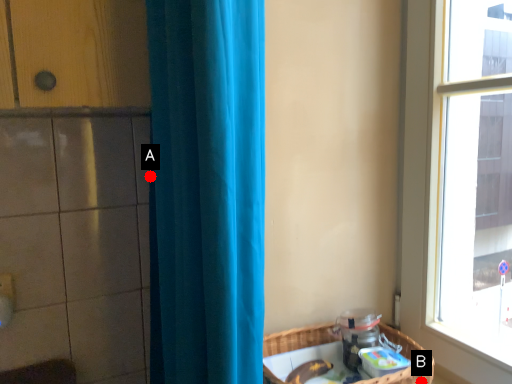
Question: Two points are circled on the image, labeled by A and B beside each circle. Among these points, which one is farthest from the camera?

Choices:
 (A) A is further
 (B) B is further

Answer: (A)